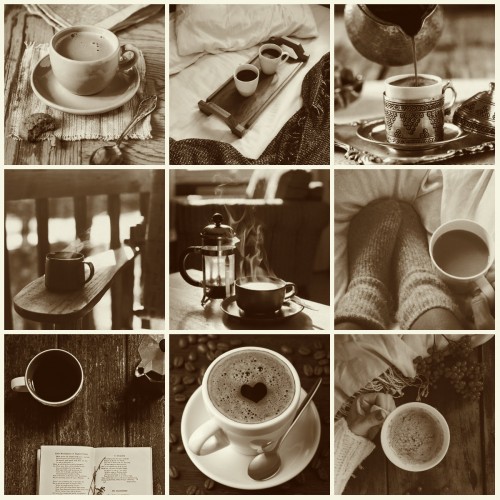
Image resolution: width=500 pixels, height=500 pixels. I want to click on saucer, so click(87, 107), click(373, 138), click(287, 311), click(213, 465).